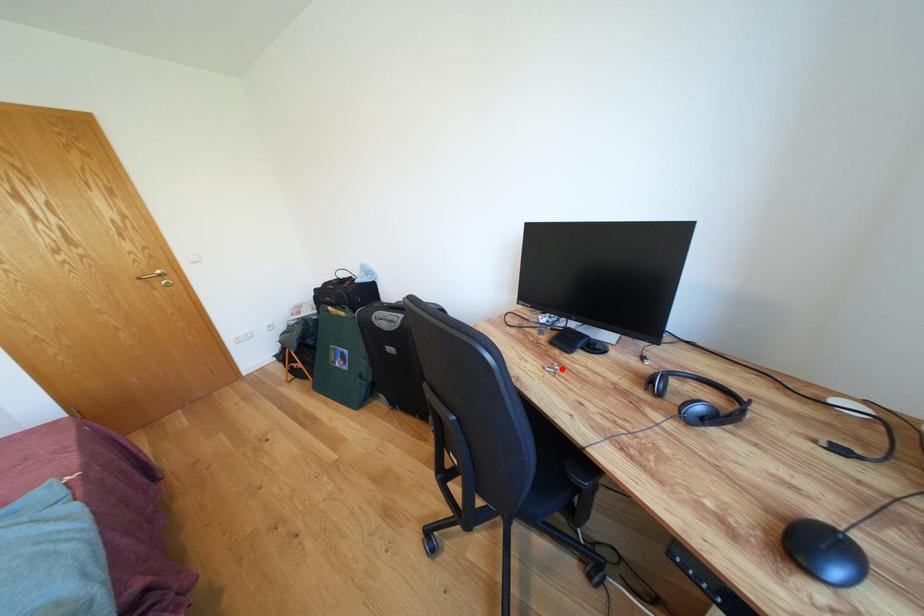
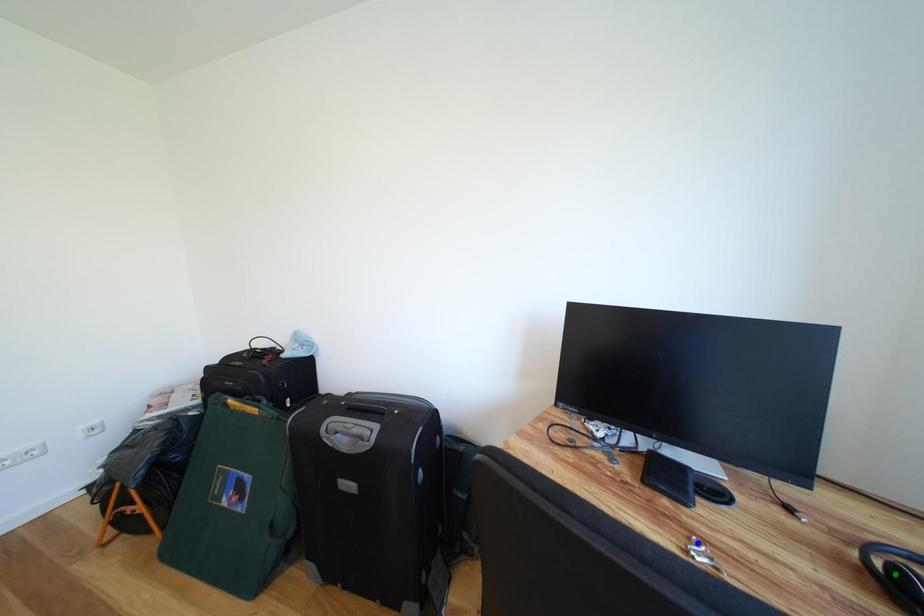
Question: I am providing you with two images of the same scene from different viewpoints. A red point is marked on the first image. You are given multiple points on the second image. Which mark in image 2 goes with the point in image 1?

Choices:
 (A) blue point
 (B) yellow point
 (C) green point

Answer: (A)